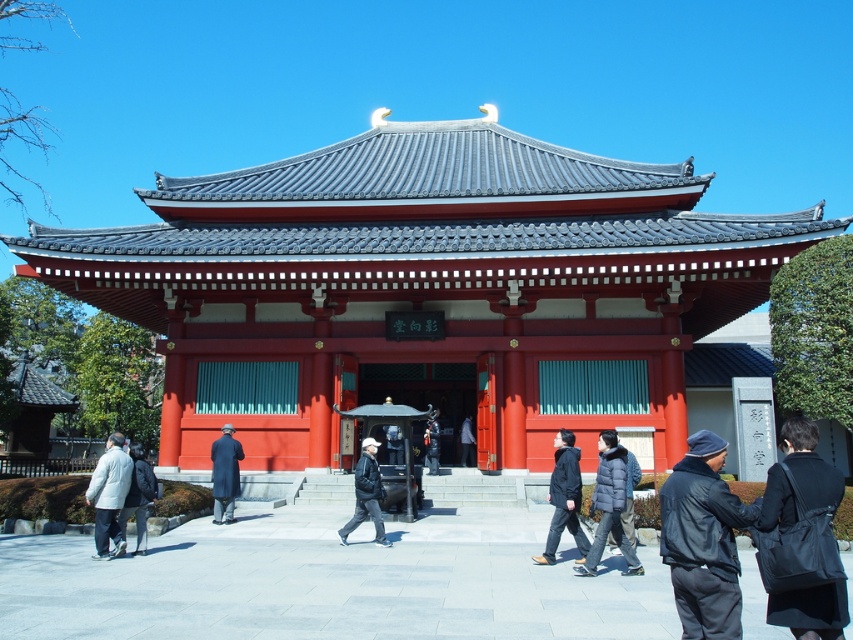
Is dark blue jacket at center taller than white cotton jacket at lower left?

No, dark blue jacket at center is not taller than white cotton jacket at lower left.

Which is in front, point (357, 516) or point (144, 480)?

Point (144, 480) is more forward.

At what (x,y) coordinates should I click in order to perform the action: click on dark blue jacket at center. Please return your answer as a coordinate pair (x, y). The image size is (853, 640). Looking at the image, I should click on (366, 493).

Does point (611, 472) come in front of point (215, 481)?

Yes, point (611, 472) is in front of point (215, 481).

Who is shorter, dark blue down jacket at center or dark gray wool coat at center?

Standing shorter between the two is dark gray wool coat at center.

Describe the element at coordinates (608, 506) in the screenshot. I see `dark blue down jacket at center` at that location.

Find the location of a particular element. dark blue down jacket at center is located at coordinates [608, 506].

Does dark blue down jacket at center come in front of dark gray jacket at center?

Yes, dark blue down jacket at center is closer to the viewer.

Is point (622, 502) positioned in front of point (463, 419)?

That is True.

Measure the distance between dark blue down jacket at center and camera.

They are 25.17 feet apart.

Where is `dark blue down jacket at center`? dark blue down jacket at center is located at coordinates (608, 506).